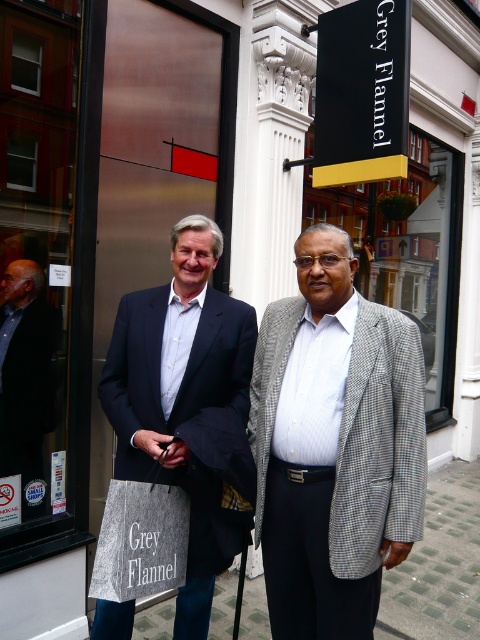
Question: Which object is farther from the camera taking this photo?

Choices:
 (A) matte black suit at center
 (B) brushed metal sign at center
 (C) matte black suit at left

Answer: (C)

Question: Which object is the closest to the brushed metal sign at center?

Choices:
 (A) black glass sign at center
 (B) matte black suit at left
 (C) gray checkered blazer at center

Answer: (B)

Question: Which is nearer to the checkered fabric suit at center?

Choices:
 (A) matte black suit at left
 (B) black glass sign at center

Answer: (A)

Question: Can you confirm if checkered fabric suit at center is positioned to the left of matte black suit at left?

Choices:
 (A) yes
 (B) no

Answer: (B)

Question: Does black glass sign at center appear on the right side of matte black suit at left?

Choices:
 (A) no
 (B) yes

Answer: (B)

Question: Is gray checkered blazer at center above black glass sign at center?

Choices:
 (A) yes
 (B) no

Answer: (B)